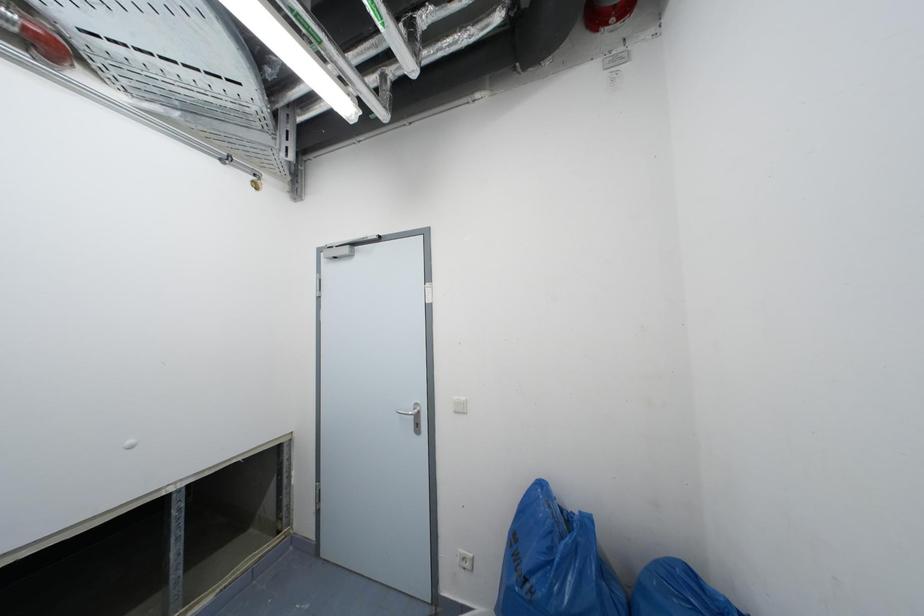
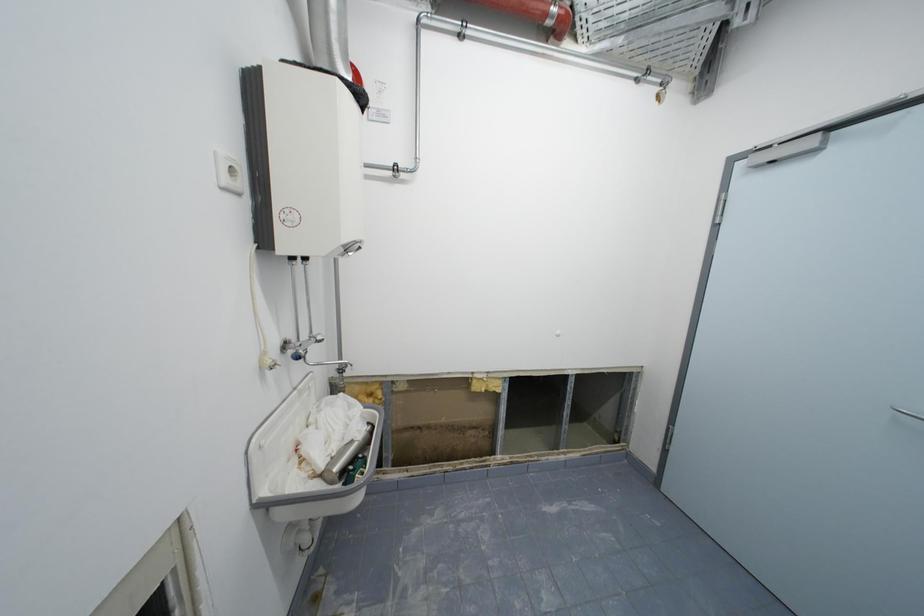
Question: The images are taken continuously from a first-person perspective. In which direction is your viewpoint rotating?

Choices:
 (A) Left
 (B) Right
 (C) Up
 (D) Down

Answer: (A)